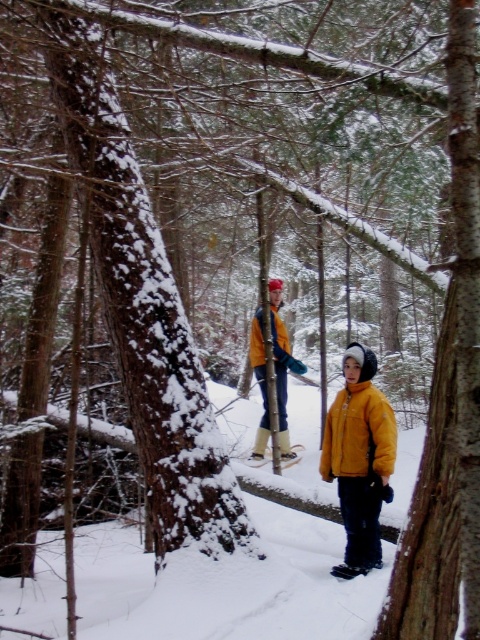
Is matte yellow jacket at center positioned in front of blue fleece jacket at center?

Yes, matte yellow jacket at center is in front of blue fleece jacket at center.

Is matte yellow jacket at center bigger than blue fleece jacket at center?

Yes.

At what (x,y) coordinates should I click in order to perform the action: click on matte yellow jacket at center. Please return your answer as a coordinate pair (x, y). Looking at the image, I should click on (360, 458).

Describe the element at coordinates (359, 433) in the screenshot. I see `yellow fuzzy jacket at lower center` at that location.

Does yellow fuzzy jacket at lower center have a greater height compared to yellow matte jacket at center?

Incorrect, yellow fuzzy jacket at lower center's height is not larger of yellow matte jacket at center's.

Between point (350, 428) and point (265, 412), which one is positioned behind?

Point (265, 412)

Find the location of `yellow fuzzy jacket at lower center`. yellow fuzzy jacket at lower center is located at coordinates (359, 433).

At what (x,y) coordinates should I click in order to perform the action: click on yellow matte jacket at center. Please return your answer as a coordinate pair (x, y). The image size is (480, 640). Looking at the image, I should click on tap(282, 364).

Looking at this image, does yellow matte jacket at center appear under blue fleece jacket at center?

Correct, yellow matte jacket at center is located below blue fleece jacket at center.

Who is more forward, (288, 448) or (276, 342)?

Point (276, 342)

This screenshot has height=640, width=480. What are the coordinates of `yellow matte jacket at center` in the screenshot? It's located at (282, 364).